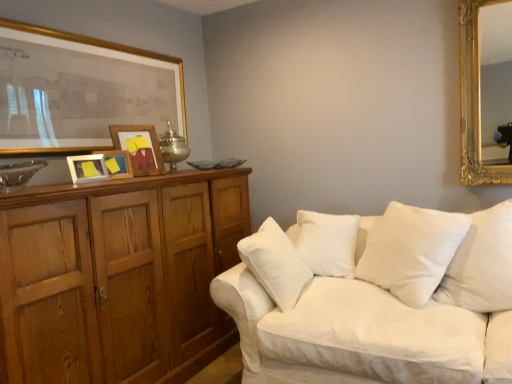
Question: From a real-world perspective, is white soft cushion at center, which is the 1th pillow in right-to-left order, physically above matte white picture frame at upper left, marked as the 2th picture frame in a front-to-back arrangement?

Choices:
 (A) no
 (B) yes

Answer: (A)

Question: Does white soft cushion at center, which is the 1th pillow in right-to-left order, have a lesser width compared to matte white picture frame at upper left, acting as the 3th picture frame starting from the back?

Choices:
 (A) no
 (B) yes

Answer: (A)

Question: Is the depth of white soft cushion at center, which is the 1th pillow in right-to-left order, greater than that of matte white picture frame at upper left, marked as the 2th picture frame in a front-to-back arrangement?

Choices:
 (A) no
 (B) yes

Answer: (A)

Question: Does white soft cushion at center, marked as the second pillow in a left-to-right arrangement, have a smaller size compared to matte white picture frame at upper left, acting as the 3th picture frame starting from the back?

Choices:
 (A) no
 (B) yes

Answer: (A)

Question: Considering the relative positions of white soft cushion at center, which is the 1th pillow in right-to-left order, and matte white picture frame at upper left, marked as the 2th picture frame in a front-to-back arrangement, in the image provided, is white soft cushion at center, which is the 1th pillow in right-to-left order, in front of matte white picture frame at upper left, marked as the 2th picture frame in a front-to-back arrangement,?

Choices:
 (A) yes
 (B) no

Answer: (A)

Question: Looking at their shapes, would you say wooden cabinet at left is wider or thinner than gold-framed picture at upper left, which appears as the first picture frame when viewed from the front?

Choices:
 (A) wide
 (B) thin

Answer: (A)

Question: Based on their positions, is wooden cabinet at left located to the left or right of gold-framed picture at upper left, the fourth picture frame positioned from the back?

Choices:
 (A) right
 (B) left

Answer: (A)

Question: Would you say wooden cabinet at left is inside or outside gold-framed picture at upper left, which appears as the first picture frame when viewed from the front?

Choices:
 (A) inside
 (B) outside

Answer: (B)

Question: Is wooden cabinet at left taller or shorter than gold-framed picture at upper left, the fourth picture frame positioned from the back?

Choices:
 (A) tall
 (B) short

Answer: (A)

Question: Does point (379, 355) appear closer or farther from the camera than point (60, 258)?

Choices:
 (A) closer
 (B) farther

Answer: (A)

Question: Considering the positions of white fabric couch at lower right and wooden cabinet at left in the image, is white fabric couch at lower right bigger or smaller than wooden cabinet at left?

Choices:
 (A) small
 (B) big

Answer: (B)

Question: Is white fabric couch at lower right taller or shorter than wooden cabinet at left?

Choices:
 (A) tall
 (B) short

Answer: (B)

Question: Is white fabric couch at lower right in front of or behind wooden cabinet at left in the image?

Choices:
 (A) behind
 (B) front

Answer: (B)

Question: Is white soft cushion at center, which is counted as the 1th pillow, starting from the left, to the left or to the right of wooden picture frame at left, the third picture frame in the front-to-back sequence, in the image?

Choices:
 (A) right
 (B) left

Answer: (A)

Question: In terms of height, does white soft cushion at center, which is counted as the 1th pillow, starting from the left, look taller or shorter compared to wooden picture frame at left, placed as the 2th picture frame when sorted from back to front?

Choices:
 (A) tall
 (B) short

Answer: (A)